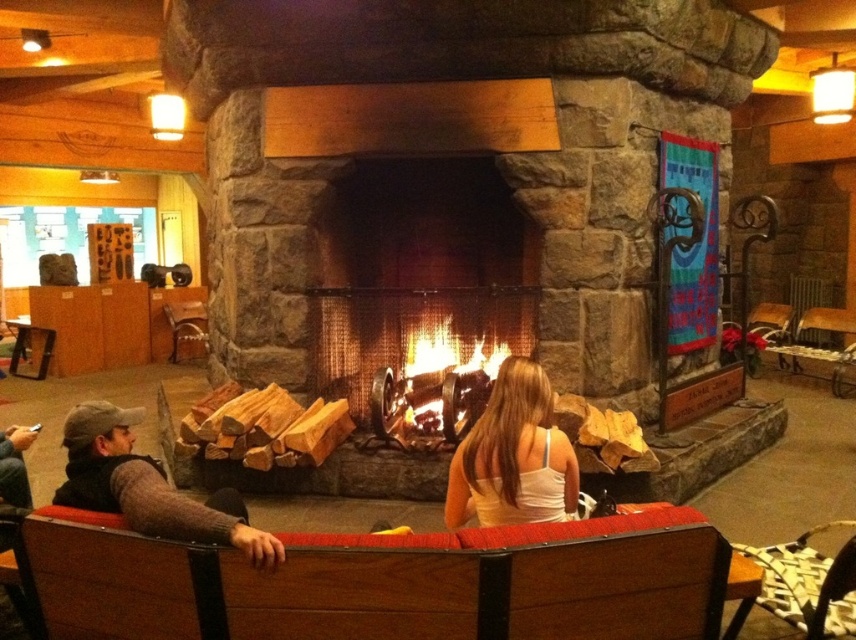
Can you confirm if wooden logs at center is wider than wooden armchair at center?

Yes.

In the scene shown: Which of these two, wooden logs at center or wooden armchair at center, stands shorter?

wooden armchair at center

This screenshot has height=640, width=856. Find the location of `wooden logs at center`. wooden logs at center is located at coordinates (421, 292).

Can you confirm if white fabric tank top at center is thinner than knit sweater at left?

Correct, white fabric tank top at center's width is less than knit sweater at left's.

Between white fabric tank top at center and knit sweater at left, which one is positioned higher?

white fabric tank top at center

Which is in front, point (494, 493) or point (135, 481)?

Positioned in front is point (135, 481).

You are a GUI agent. You are given a task and a screenshot of the screen. Output one action in this format:
    pyautogui.click(x=<x>, y=<y>)
    Task: Click on the white fabric tank top at center
    
    Given the screenshot: What is the action you would take?
    pyautogui.click(x=513, y=456)

Does point (331, 340) lie in front of point (488, 524)?

No, (331, 340) is further to viewer.

Which is more to the left, wooden logs at center or white fabric tank top at center?

wooden logs at center is more to the left.

At what (x,y) coordinates should I click in order to perform the action: click on wooden logs at center. Please return your answer as a coordinate pair (x, y). Looking at the image, I should click on (421, 292).